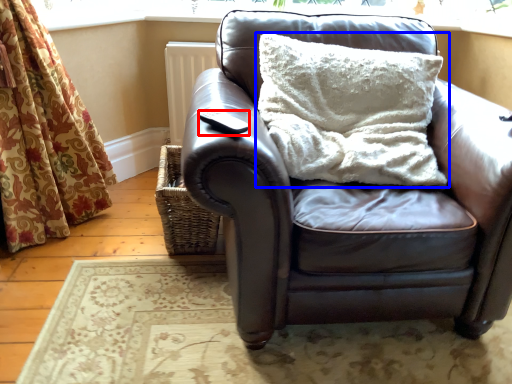
Question: Which of the following is the farthest to the observer, pad (highlighted by a red box) or pillow (highlighted by a blue box)?

Choices:
 (A) pad
 (B) pillow

Answer: (B)